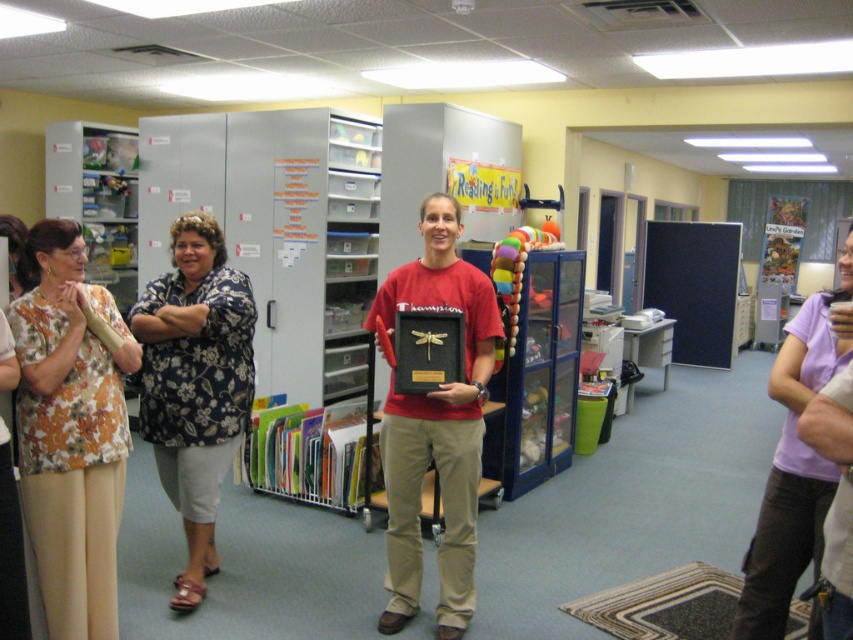
Is floral fabric blouse at left smaller than purple cotton shirt at right?

Correct, floral fabric blouse at left occupies less space than purple cotton shirt at right.

Which is behind, point (225, 408) or point (753, 547)?

Positioned behind is point (225, 408).

Is point (234, 365) closer to viewer compared to point (819, 339)?

No, it is not.

This screenshot has height=640, width=853. In order to click on floral fabric blouse at left in this screenshot , I will do `click(195, 384)`.

Does matte red t-shirt at center lie behind purple cotton shirt at right?

Yes.

The width and height of the screenshot is (853, 640). Describe the element at coordinates (434, 426) in the screenshot. I see `matte red t-shirt at center` at that location.

Is point (432, 260) farther from viewer compared to point (805, 349)?

Yes, it is.

This screenshot has width=853, height=640. I want to click on matte red t-shirt at center, so click(x=434, y=426).

Does floral fabric blouse at left appear on the left side of purple fabric shirt at center?

Correct, you'll find floral fabric blouse at left to the left of purple fabric shirt at center.

Does floral fabric blouse at left appear under purple fabric shirt at center?

No.

Describe the element at coordinates (195, 384) in the screenshot. This screenshot has height=640, width=853. I see `floral fabric blouse at left` at that location.

What are the coordinates of `floral fabric blouse at left` in the screenshot? It's located at (195, 384).